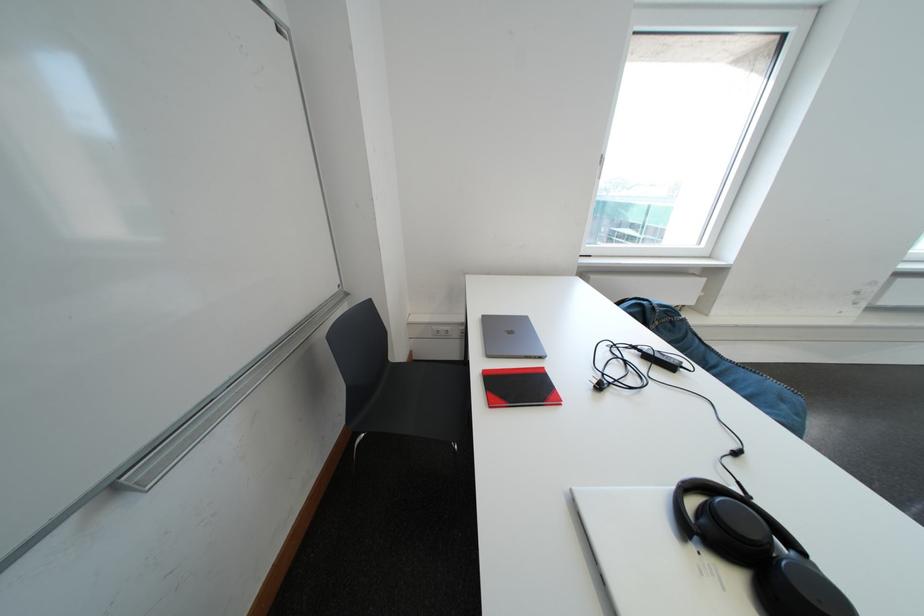
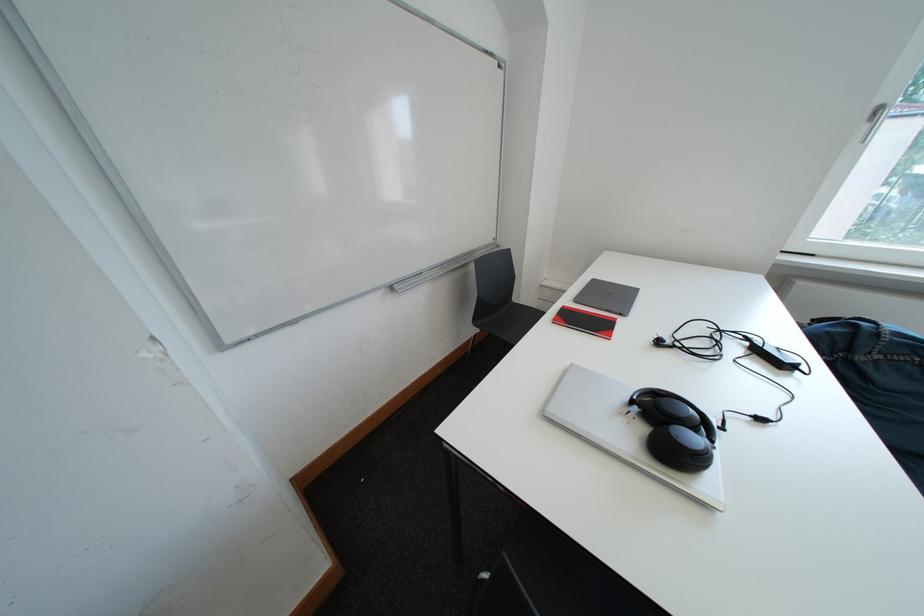
Where in the second image is the point corresponding to pixel 643 351 from the first image?

(758, 342)